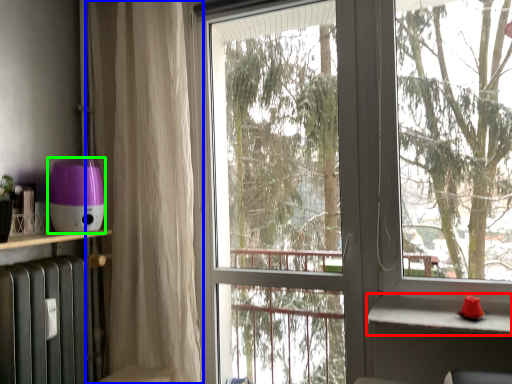
Question: Based on their relative distances, which object is farther from window sill (highlighted by a red box)? Choose from curtain (highlighted by a blue box) and appliance (highlighted by a green box).

Choices:
 (A) curtain
 (B) appliance

Answer: (B)